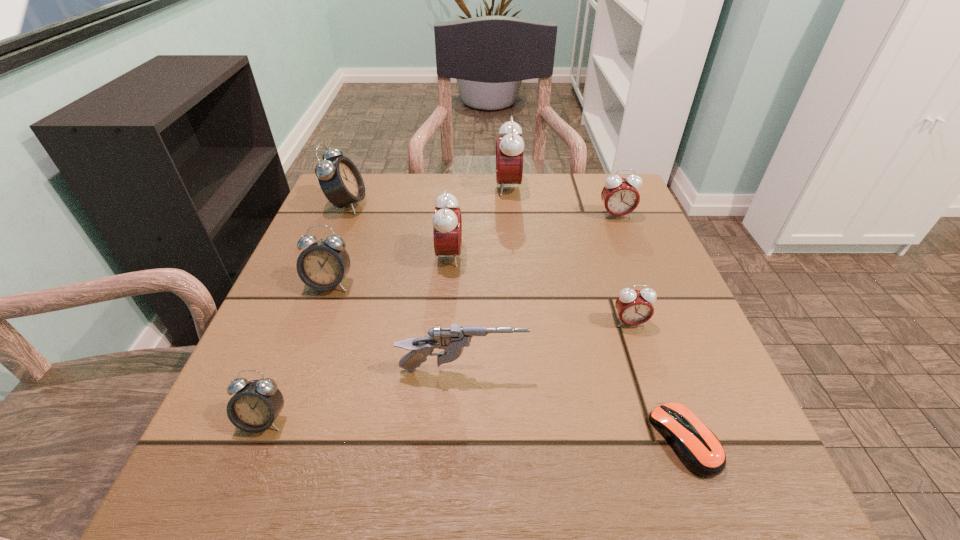
Find the location of a particular element. This screenshot has height=540, width=960. the tallest alarm clock is located at coordinates (509, 149).

Identify the location of the tallest object. The height and width of the screenshot is (540, 960). (509, 149).

Identify the location of the biggest white alarm clock. The width and height of the screenshot is (960, 540). (340, 180).

Image resolution: width=960 pixels, height=540 pixels. Identify the location of the leftmost pink alarm clock. (447, 222).

At what (x,y) coordinates should I click in order to perform the action: click on the third farthest pink alarm clock. Please return your answer as a coordinate pair (x, y). Looking at the image, I should click on (447, 222).

The height and width of the screenshot is (540, 960). I want to click on the second farthest pink alarm clock, so click(x=619, y=195).

Locate an element on the screen. Image resolution: width=960 pixels, height=540 pixels. the second smallest white alarm clock is located at coordinates (322, 266).

Identify the location of the third nearest object. The height and width of the screenshot is (540, 960). (453, 340).

What are the coordinates of `the sixth farthest alarm clock` in the screenshot? It's located at (634, 307).

The height and width of the screenshot is (540, 960). In order to click on the smallest pink alarm clock in this screenshot , I will do (634, 307).